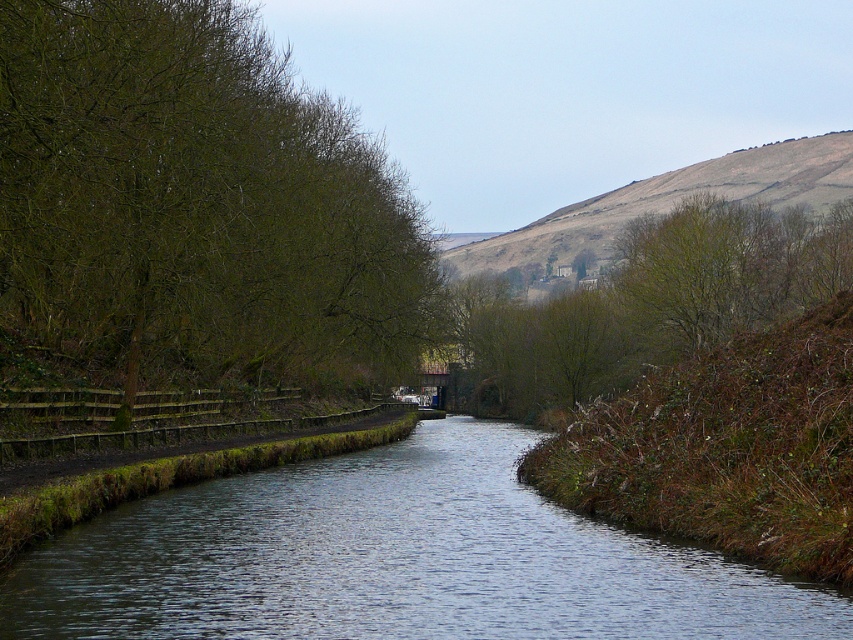
Which is below, green leafy tree at left or smooth concrete canal at center?

Positioned lower is smooth concrete canal at center.

Where is `green leafy tree at left`? The image size is (853, 640). green leafy tree at left is located at coordinates (193, 211).

Is point (33, 346) positioned in front of point (51, 572)?

No, (33, 346) is behind (51, 572).

You are a GUI agent. You are given a task and a screenshot of the screen. Output one action in this format:
    pyautogui.click(x=<x>, y=<y>)
    Task: Click on the green leafy tree at left
    
    Given the screenshot: What is the action you would take?
    pyautogui.click(x=193, y=211)

Measure the distance from smooth concrete canal at center to brown grassy hillside at upper center.

smooth concrete canal at center is 70.38 meters away from brown grassy hillside at upper center.

Is point (248, 548) closer to camera compared to point (761, 148)?

Yes, it is.

This screenshot has width=853, height=640. What are the coordinates of `smooth concrete canal at center` in the screenshot? It's located at (392, 560).

Between green leafy tree at left and brown grassy hillside at upper center, which one has less height?

brown grassy hillside at upper center is shorter.

Is green leafy tree at left smaller than brown grassy hillside at upper center?

Actually, green leafy tree at left might be larger than brown grassy hillside at upper center.

Who is more distant from viewer, (44, 29) or (450, 257)?

The point (450, 257) is behind.

What are the coordinates of `green leafy tree at left` in the screenshot? It's located at (193, 211).